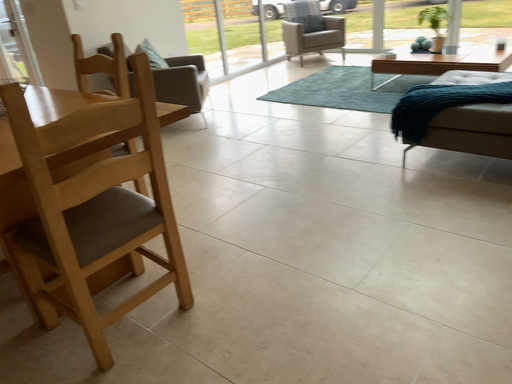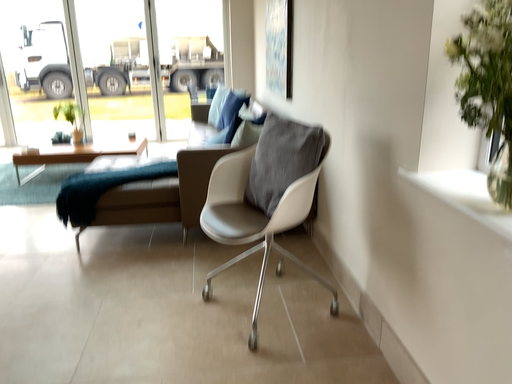
Question: How did the camera likely rotate when shooting the video?

Choices:
 (A) rotated downward
 (B) rotated upward

Answer: (B)